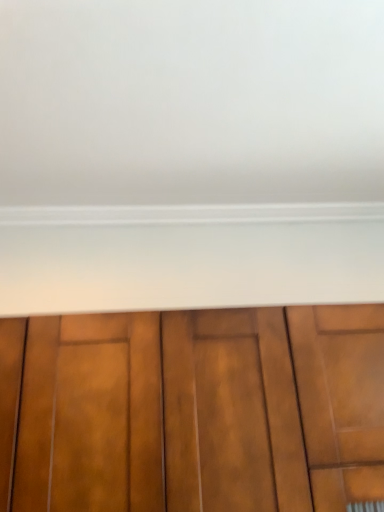
In order to face brown wood door at bottom, should I rotate leftwards or rightwards?

It's best to rotate right around 2.847 degrees.

The image size is (384, 512). In order to click on brown wood door at bottom in this screenshot , I will do `click(193, 410)`.

The width and height of the screenshot is (384, 512). What do you see at coordinates (193, 410) in the screenshot? I see `brown wood door at bottom` at bounding box center [193, 410].

Image resolution: width=384 pixels, height=512 pixels. Identify the location of brown wood door at bottom. (193, 410).